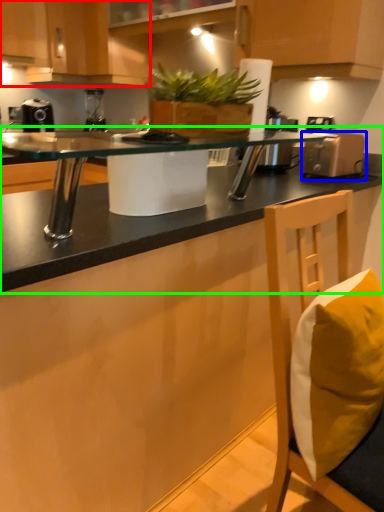
Question: Which object is the closest to the cabinetry (highlighted by a red box)? Choose among these: appliance (highlighted by a blue box) or countertop (highlighted by a green box).

Choices:
 (A) appliance
 (B) countertop

Answer: (A)